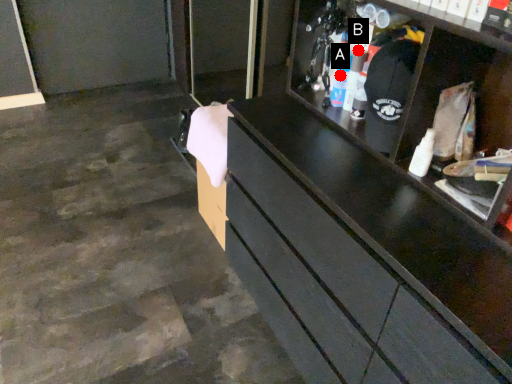
Question: Two points are circled on the image, labeled by A and B beside each circle. Among these points, which one is farthest from the camera?

Choices:
 (A) A is further
 (B) B is further

Answer: (A)